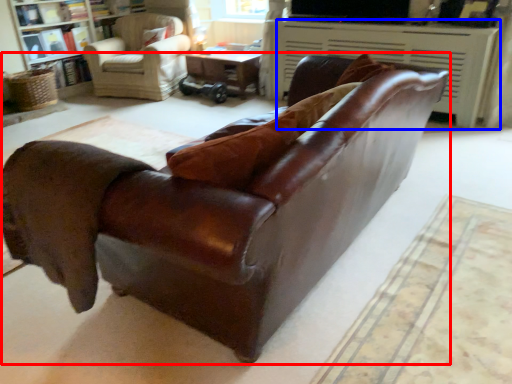
Question: Which point is further to the camera, studio couch (highlighted by a red box) or fireplace (highlighted by a blue box)?

Choices:
 (A) studio couch
 (B) fireplace

Answer: (B)